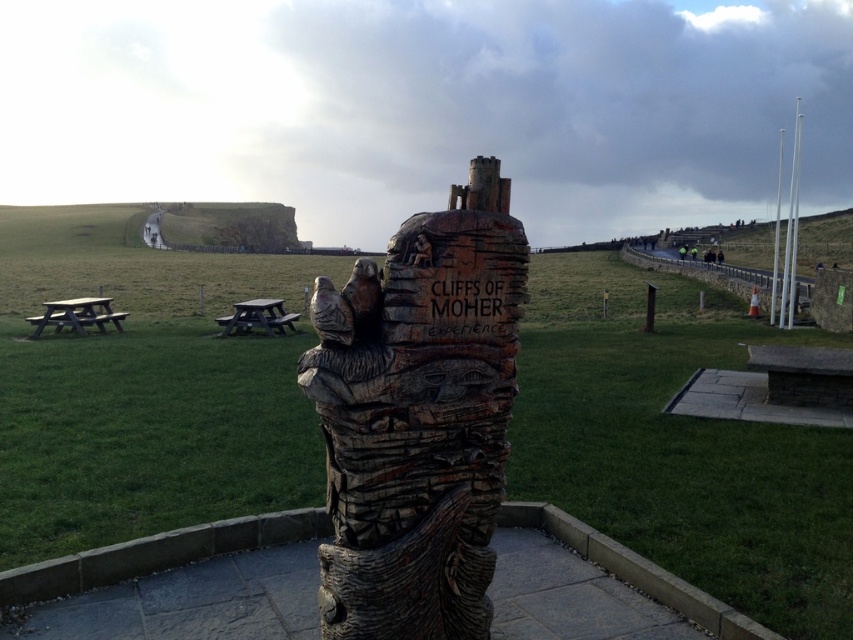
Which is below, wooden totem pole at center or wooden picnic table at center-left?

wooden picnic table at center-left is lower down.

Who is positioned more to the left, wooden totem pole at center or wooden picnic table at center-left?

From the viewer's perspective, wooden totem pole at center appears more on the left side.

Is point (51, 285) positioned after point (282, 301)?

Yes.

Identify the location of wooden totem pole at center. (144, 387).

Does wooden carving at center come in front of white wood totem pole at right?

Yes, wooden carving at center is closer to the viewer.

Is wooden carving at center smaller than white wood totem pole at right?

Correct, wooden carving at center occupies less space than white wood totem pole at right.

Who is more forward, (467, 440) or (782, 324)?

Point (467, 440)

The width and height of the screenshot is (853, 640). In order to click on wooden carving at center in this screenshot , I will do `click(418, 417)`.

Can you confirm if wooden carving at center is taller than wooden picnic table at left?

Yes, wooden carving at center is taller than wooden picnic table at left.

Can you confirm if wooden carving at center is positioned above wooden picnic table at left?

No, wooden carving at center is not above wooden picnic table at left.

Who is more distant from viewer, (346, 515) or (74, 323)?

The point (74, 323) is behind.

The height and width of the screenshot is (640, 853). Find the location of `wooden carving at center`. wooden carving at center is located at coordinates (418, 417).